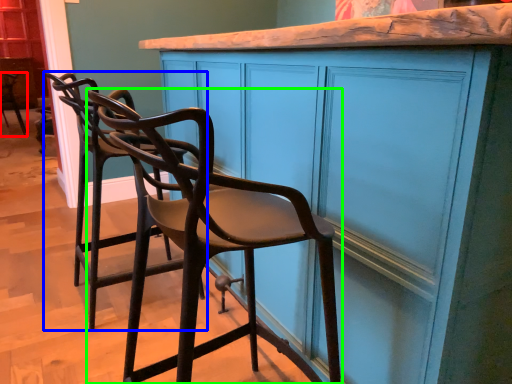
Question: Estimate the real-world distances between objects in this image. Which object is farther from chair (highlighted by a red box), chair (highlighted by a blue box) or chair (highlighted by a green box)?

Choices:
 (A) chair
 (B) chair

Answer: (B)